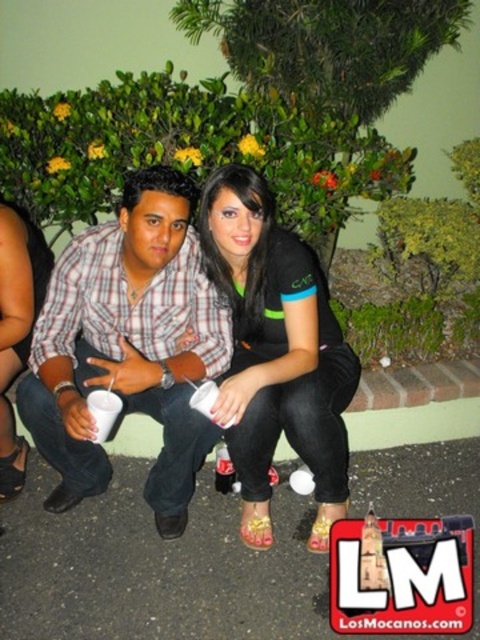
Question: Which point is closer to the camera taking this photo?

Choices:
 (A) (315, 541)
 (B) (84, 416)

Answer: (B)

Question: Does plaid shirt at center have a lesser width compared to black matte shirt at center?

Choices:
 (A) no
 (B) yes

Answer: (A)

Question: Considering the relative positions of plaid shirt at center and black matte shirt at center in the image provided, where is plaid shirt at center located with respect to black matte shirt at center?

Choices:
 (A) above
 (B) below

Answer: (B)

Question: Considering the relative positions of plaid shirt at center and black matte shirt at center in the image provided, where is plaid shirt at center located with respect to black matte shirt at center?

Choices:
 (A) below
 (B) above

Answer: (A)